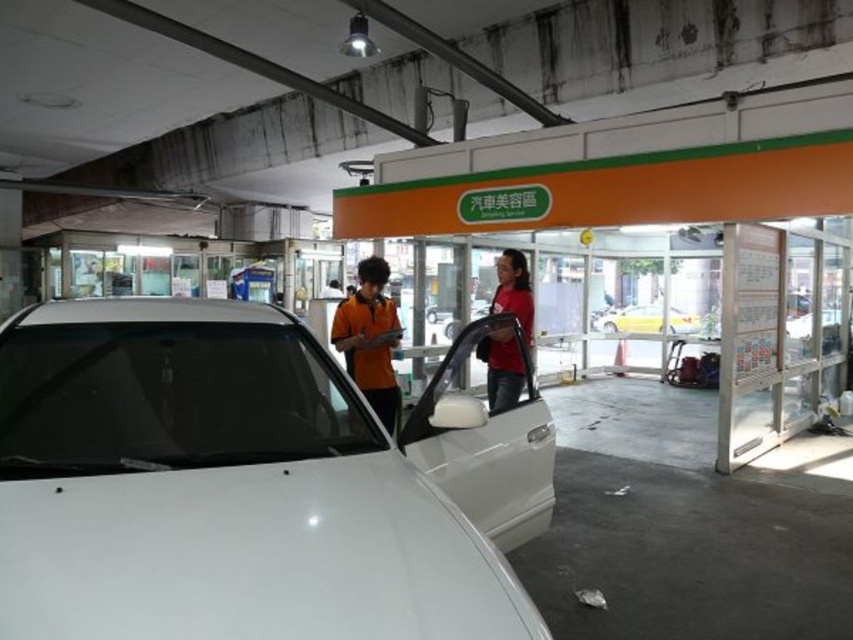
Question: Can you confirm if white glossy car at center is smaller than orange matte shirt at center?

Choices:
 (A) yes
 (B) no

Answer: (B)

Question: Which of the following is the closest to the observer?

Choices:
 (A) (498, 266)
 (B) (299, 432)
 (C) (639, 308)

Answer: (B)

Question: Which of the following is the farthest from the observer?

Choices:
 (A) (132, 522)
 (B) (509, 342)

Answer: (B)

Question: Is matte red shirt at center closer to the viewer compared to white matte car at center?

Choices:
 (A) yes
 (B) no

Answer: (A)

Question: Among these objects, which one is farthest from the camera?

Choices:
 (A) orange matte shirt at center
 (B) white matte car at center
 (C) matte red shirt at center
 (D) white glossy car at center

Answer: (B)

Question: From the image, what is the correct spatial relationship of white glossy car at center in relation to yellow matte taxi at center?

Choices:
 (A) below
 (B) above

Answer: (A)